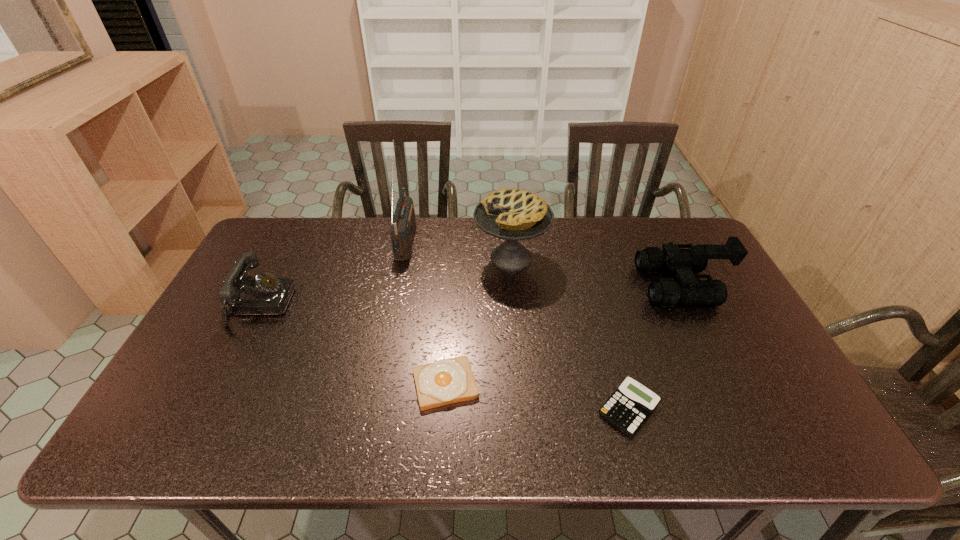
Image resolution: width=960 pixels, height=540 pixels. In order to click on radio receiver in this screenshot , I will do `click(403, 224)`.

The height and width of the screenshot is (540, 960). Identify the location of the second object from left to right. (403, 224).

Locate an element on the screen. The height and width of the screenshot is (540, 960). the fifth shortest object is located at coordinates (511, 214).

The image size is (960, 540). Find the location of `the third tallest object`. the third tallest object is located at coordinates (666, 292).

The height and width of the screenshot is (540, 960). I want to click on the rightmost object, so click(x=666, y=292).

This screenshot has height=540, width=960. Find the location of `the leftmost object`. the leftmost object is located at coordinates (266, 294).

Identify the location of telephone. The width and height of the screenshot is (960, 540). (266, 294).

This screenshot has width=960, height=540. Identify the location of toast. (446, 381).

Find the location of a particular element. The height and width of the screenshot is (540, 960). the second object from right to left is located at coordinates (628, 408).

The image size is (960, 540). In order to click on free spot located on the front-facing side of the fifth object from right to left in this screenshot , I will do `click(472, 239)`.